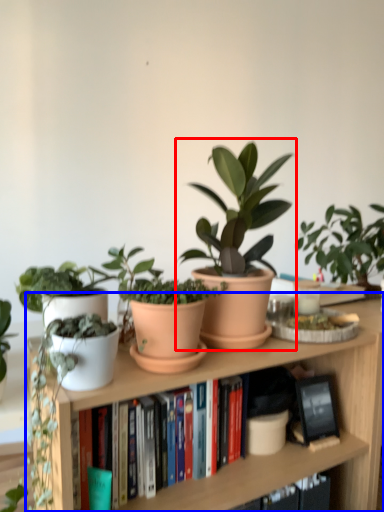
Question: Which point is further to the camera, houseplant (highlighted by a red box) or bookcase (highlighted by a blue box)?

Choices:
 (A) houseplant
 (B) bookcase

Answer: (A)